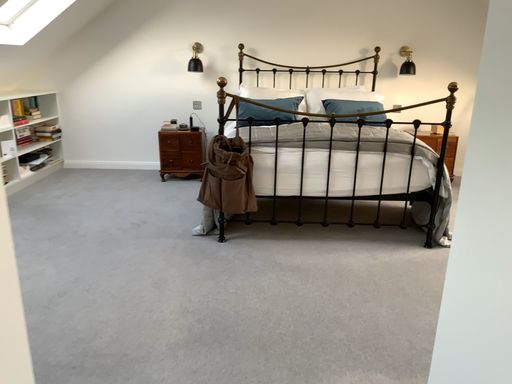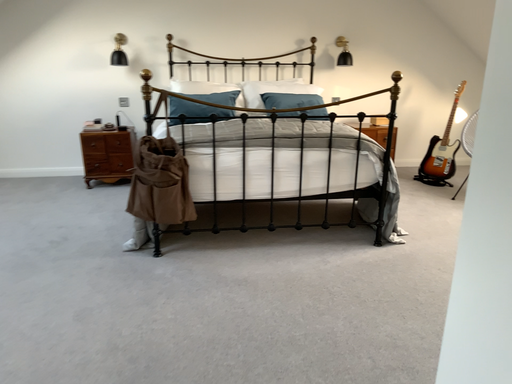
Question: Which way did the camera rotate in the video?

Choices:
 (A) rotated left
 (B) rotated right

Answer: (B)